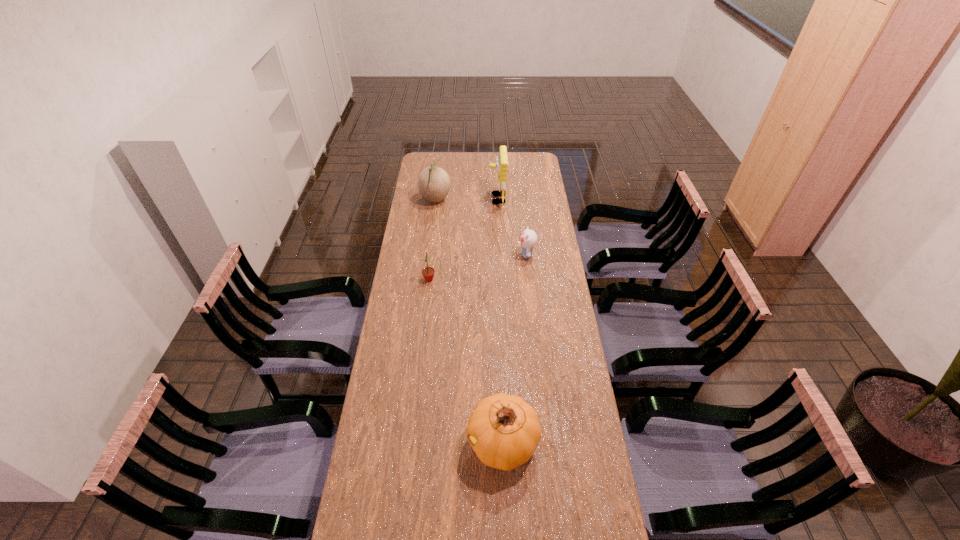
Image resolution: width=960 pixels, height=540 pixels. I want to click on free point located on the front of the cantaloup, so click(x=428, y=255).

The height and width of the screenshot is (540, 960). Identify the location of vacant region located on the front face of the nearest object. (368, 443).

You are a GUI agent. You are given a task and a screenshot of the screen. Output one action in this format:
    pyautogui.click(x=<x>, y=<y>)
    Task: Click on the vacant space located on the front face of the nearest object
    
    Given the screenshot: What is the action you would take?
    pyautogui.click(x=412, y=443)

You are a GUI agent. You are given a task and a screenshot of the screen. Output one action in this format:
    pyautogui.click(x=<x>, y=<y>)
    Task: Click on the vacant point located 0.180m on the front face of the nearest object
    The width and height of the screenshot is (960, 540).
    Given the screenshot: What is the action you would take?
    pyautogui.click(x=412, y=443)

The height and width of the screenshot is (540, 960). I want to click on vacant area situated 0.210m on the face of the second nearest object, so click(x=483, y=279).

I want to click on vacant space located on the front-facing side of the third farthest object, so (x=492, y=254).

This screenshot has height=540, width=960. Find the location of `vacant region located on the front-facing side of the third farthest object`. vacant region located on the front-facing side of the third farthest object is located at coordinates (443, 254).

Where is `blank area located on the front-facing side of the third farthest object`? Image resolution: width=960 pixels, height=540 pixels. blank area located on the front-facing side of the third farthest object is located at coordinates tap(488, 254).

Find the location of `cantaloup positioned at the left edge`. cantaloup positioned at the left edge is located at coordinates (433, 183).

Locate an element on the screen. sunflower positioned at the left edge is located at coordinates (428, 272).